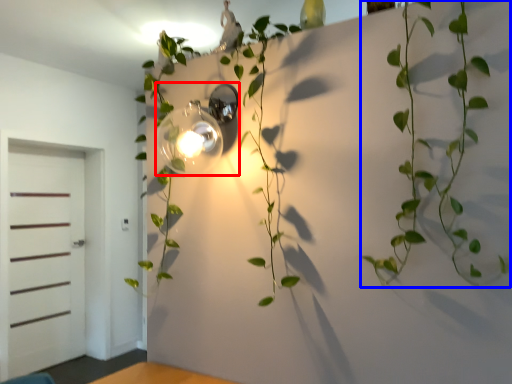
Question: Which object is further to the camera taking this photo, light fixture (highlighted by a red box) or houseplant (highlighted by a blue box)?

Choices:
 (A) light fixture
 (B) houseplant

Answer: (A)